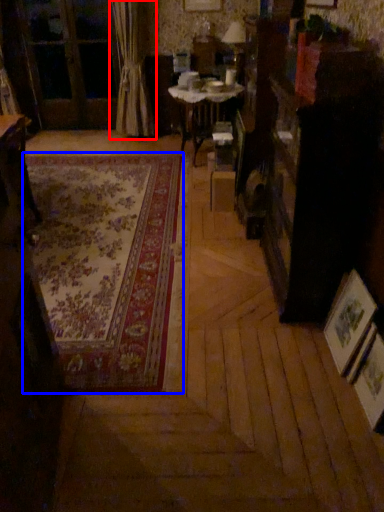
Question: Which of the following is the farthest to the observer, curtain (highlighted by a red box) or mat (highlighted by a blue box)?

Choices:
 (A) curtain
 (B) mat

Answer: (A)